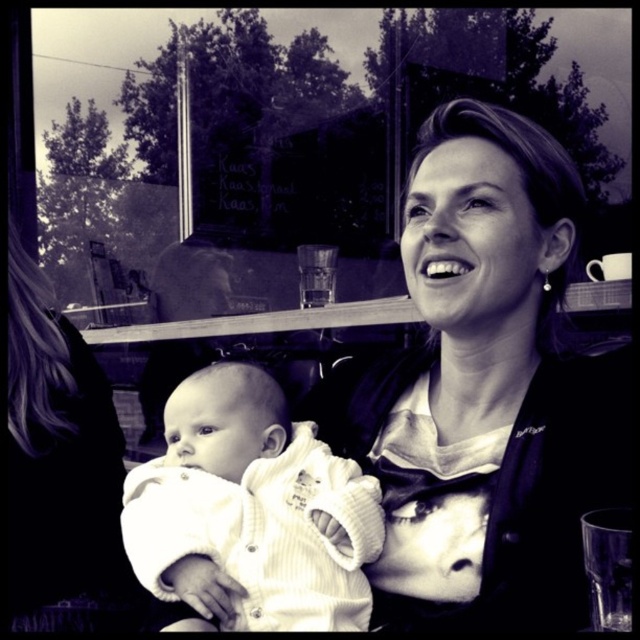
Question: Which of these objects is positioned farthest from the matte black jacket at center?

Choices:
 (A) white soft baby at center
 (B) white corduroy baby at center

Answer: (A)

Question: Can you confirm if white corduroy baby at center is positioned above white soft baby at center?

Choices:
 (A) yes
 (B) no

Answer: (B)

Question: Can you confirm if matte black jacket at center is positioned below white soft baby at center?

Choices:
 (A) no
 (B) yes

Answer: (A)

Question: Which of the following is the farthest from the observer?

Choices:
 (A) white corduroy baby at center
 (B) white soft baby at center
 (C) matte black jacket at center

Answer: (B)

Question: Which point is closer to the camera?

Choices:
 (A) (308, 532)
 (B) (54, 624)
 (C) (576, 474)

Answer: (C)

Question: Is matte black jacket at center bigger than white corduroy baby at center?

Choices:
 (A) no
 (B) yes

Answer: (B)